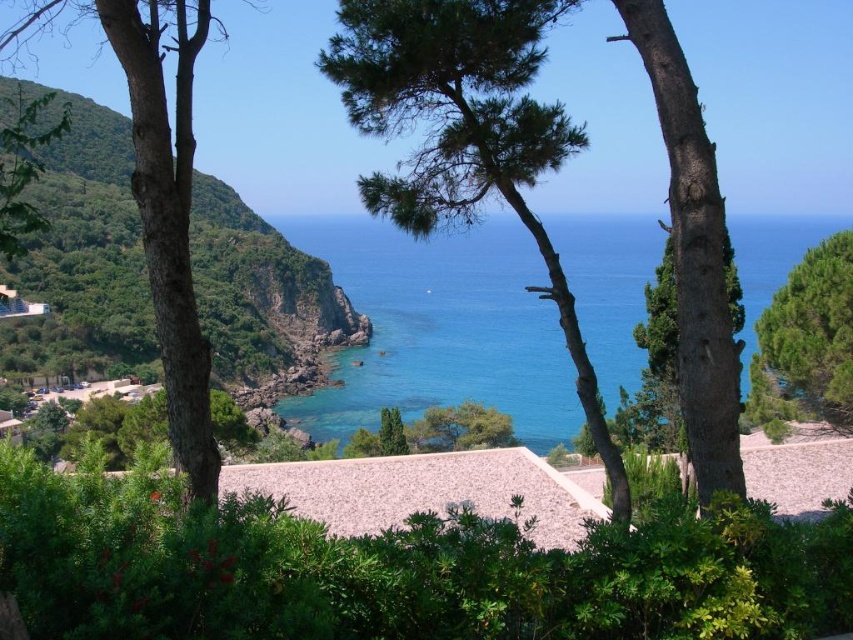
Can you confirm if green textured pine tree at center is positioned below smooth brown tree trunk at left?

Yes, green textured pine tree at center is below smooth brown tree trunk at left.

Who is more distant from viewer, [601,436] or [204,456]?

Positioned behind is point [601,436].

Identify the location of green textured pine tree at center. This screenshot has width=853, height=640. [465, 134].

Does smooth brown tree trunk at right come in front of green leafy tree at center?

Yes, it is in front of green leafy tree at center.

Who is taller, smooth brown tree trunk at right or green leafy tree at center?

smooth brown tree trunk at right is taller.

Who is more distant from viewer, (688,333) or (460,422)?

The point (460,422) is more distant.

I want to click on smooth brown tree trunk at right, so click(693, 256).

Can you confirm if smooth brown tree trunk at left is bigger than smooth brown tree trunk at right?

Correct, smooth brown tree trunk at left is larger in size than smooth brown tree trunk at right.

Can you confirm if smooth brown tree trunk at left is thinner than smooth brown tree trunk at right?

No.

Does point (177, 220) come closer to viewer compared to point (712, 451)?

Yes, point (177, 220) is closer to viewer.

Where is `smooth brown tree trunk at left`? Image resolution: width=853 pixels, height=640 pixels. smooth brown tree trunk at left is located at coordinates (167, 209).